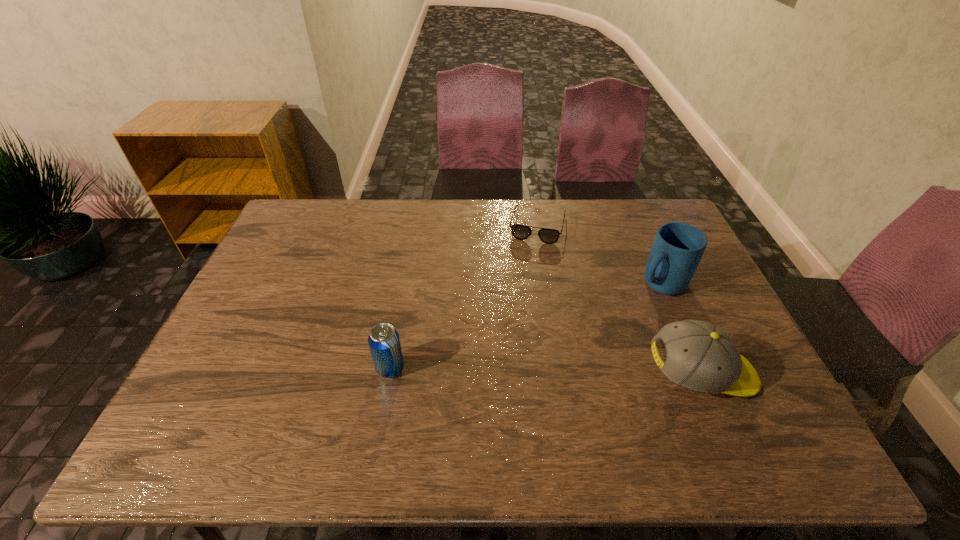
Find the location of a particular element. The image size is (960, 540). vacant space in between the third nearest object and the farthest object is located at coordinates (599, 254).

Identify the location of object that is the second closest to the shortest object. This screenshot has width=960, height=540. (701, 357).

Select which object is the closest to the beer can. Please provide its 2D coordinates. Your answer should be formatted as a tuple, i.e. [(x, y)], where the tuple contains the x and y coordinates of a point satisfying the conditions above.

[(521, 232)]

You are a GUI agent. You are given a task and a screenshot of the screen. Output one action in this format:
    pyautogui.click(x=<x>, y=<y>)
    Task: Click on the vacant region that satisfies the following two spatial constraints: 1. on the front side of the baseball cap; 2. on the front-facing side of the third nearest object
    The image size is (960, 540).
    Given the screenshot: What is the action you would take?
    pyautogui.click(x=699, y=374)

Where is `vacant area in the image that satisfies the following two spatial constraints: 1. on the front side of the farthest object; 2. on the front-facing side of the baseball cap`? This screenshot has height=540, width=960. vacant area in the image that satisfies the following two spatial constraints: 1. on the front side of the farthest object; 2. on the front-facing side of the baseball cap is located at coordinates click(562, 374).